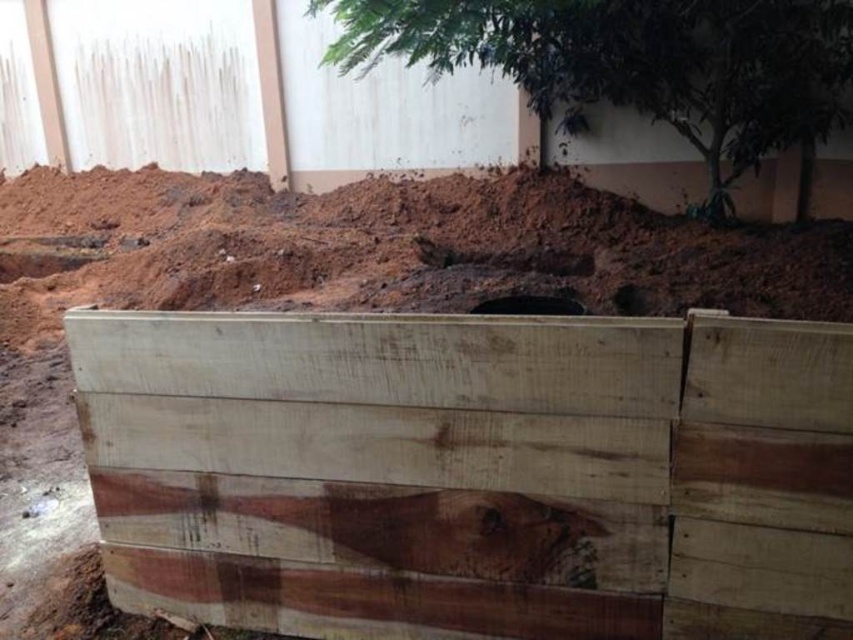
Question: Is weathered wood crate at center positioned behind green leafy tree at upper center?

Choices:
 (A) yes
 (B) no

Answer: (B)

Question: Which of the following is the closest to the observer?

Choices:
 (A) 78,317
 (B) 811,58

Answer: (A)

Question: Can you confirm if weathered wood crate at center is positioned to the right of green leafy tree at upper center?

Choices:
 (A) no
 (B) yes

Answer: (A)

Question: Which point is closer to the camera?

Choices:
 (A) (602, 336)
 (B) (569, 52)

Answer: (A)

Question: Where is weathered wood crate at center located in relation to green leafy tree at upper center in the image?

Choices:
 (A) right
 (B) left

Answer: (B)